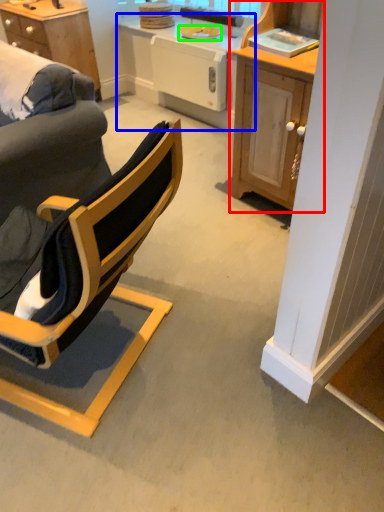
Question: Considering the real-world distances, which object is farthest from cabinetry (highlighted by a red box)? table (highlighted by a blue box) or plate (highlighted by a green box)?

Choices:
 (A) table
 (B) plate

Answer: (B)